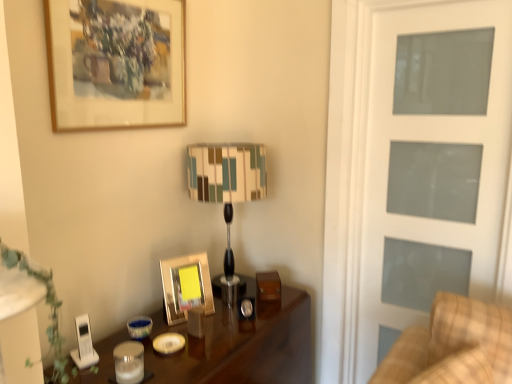
Question: In terms of size, does plaid fabric couch at right appear bigger or smaller than shiny dark wood table at center?

Choices:
 (A) small
 (B) big

Answer: (A)

Question: From a real-world perspective, relative to shiny dark wood table at center, is plaid fabric couch at right vertically above or below?

Choices:
 (A) above
 (B) below

Answer: (A)

Question: Which object is the closest to the wooden framed artwork at upper left, the first picture frame viewed from the top?

Choices:
 (A) gold metallic picture frame at center, which ranks as the first picture frame in bottom-to-top order
 (B) white frosted glass screen door at right
 (C) striped fabric lampshade at center
 (D) plaid fabric couch at right
 (E) shiny dark wood table at center

Answer: (C)

Question: Which of these objects is positioned closest to the shiny dark wood table at center?

Choices:
 (A) striped fabric lampshade at center
 (B) green leafy plant at lower left
 (C) gold metallic picture frame at center, which ranks as the first picture frame in bottom-to-top order
 (D) wooden framed artwork at upper left, which is the second picture frame from bottom to top
 (E) white frosted glass screen door at right

Answer: (C)